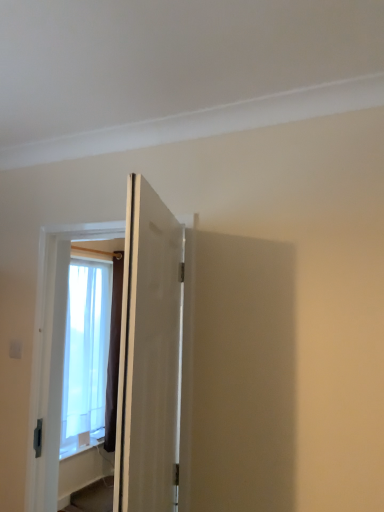
Question: Is point (56, 414) positioned closer to the camera than point (175, 361)?

Choices:
 (A) closer
 (B) farther

Answer: (B)

Question: Is white matte door at center, marked as the 1th door in a back-to-front arrangement, taller or shorter than matte white door at center, which appears as the first door when viewed from the front?

Choices:
 (A) short
 (B) tall

Answer: (B)

Question: Estimate the real-world distances between objects in this image. Which object is closer to the matte white door at center, which appears as the first door when viewed from the front?

Choices:
 (A) translucent fabric window at left
 (B) white matte door at center, placed as the 2th door when sorted from front to back

Answer: (B)

Question: Based on their relative distances, which object is farther from the translucent fabric window at left?

Choices:
 (A) matte white door at center, which appears as the first door when viewed from the front
 (B) white matte door at center, placed as the 2th door when sorted from front to back

Answer: (A)